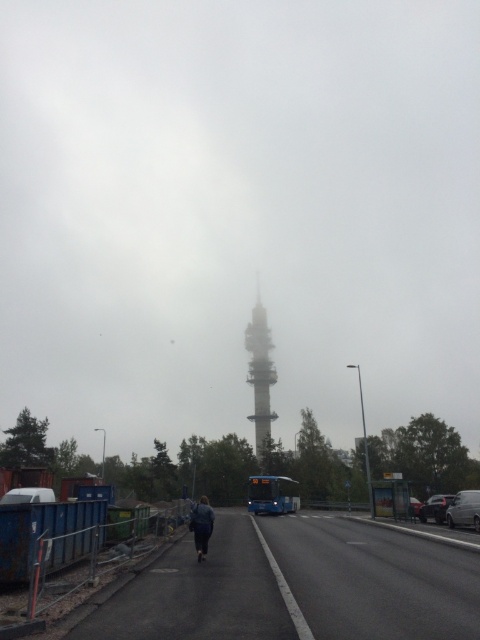
Between white smooth tower at center and shiny black car at lower right, which one appears on the left side from the viewer's perspective?

From the viewer's perspective, white smooth tower at center appears more on the left side.

Can you confirm if white smooth tower at center is wider than shiny black car at lower right?

No.

Find the location of a particular element. white smooth tower at center is located at coordinates (260, 372).

Which is in front, point (139, 637) or point (194, 504)?

Point (139, 637) is in front.

Can you confirm if asphalt road at lower center is positioned to the left of dark blue jacket at center?

Incorrect, asphalt road at lower center is not on the left side of dark blue jacket at center.

Which is in front, point (336, 532) or point (201, 499)?

Point (336, 532) is more forward.

This screenshot has width=480, height=640. In order to click on asphalt road at lower center in this screenshot , I will do `click(373, 580)`.

Can you confirm if white smooth tower at center is positioned above blue metallic bus at center?

Correct, white smooth tower at center is located above blue metallic bus at center.

Is the position of white smooth tower at center more distant than that of blue metallic bus at center?

Yes, it is behind blue metallic bus at center.

Where is `white smooth tower at center`? This screenshot has height=640, width=480. white smooth tower at center is located at coordinates (260, 372).